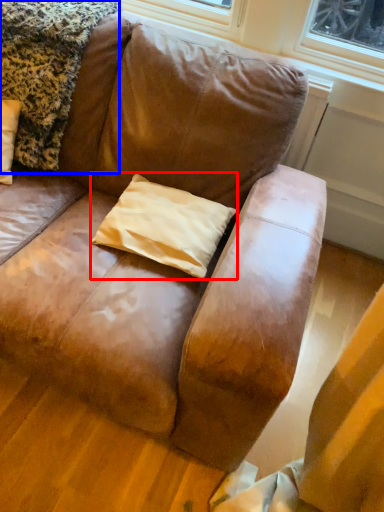
Question: Which object is closer to the camera taking this photo, pillow (highlighted by a red box) or blanket (highlighted by a blue box)?

Choices:
 (A) pillow
 (B) blanket

Answer: (B)